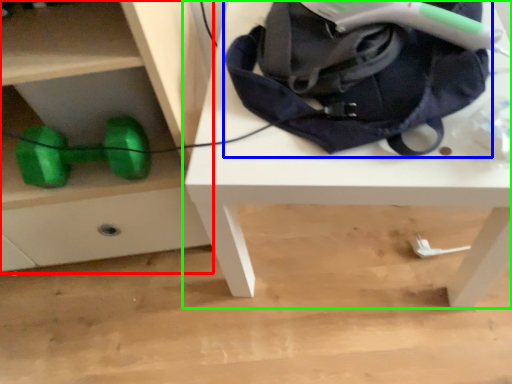
Question: Which object is the closest to the chest of drawers (highlighted by a red box)? Choose among these: bag (highlighted by a blue box) or table (highlighted by a green box).

Choices:
 (A) bag
 (B) table

Answer: (B)